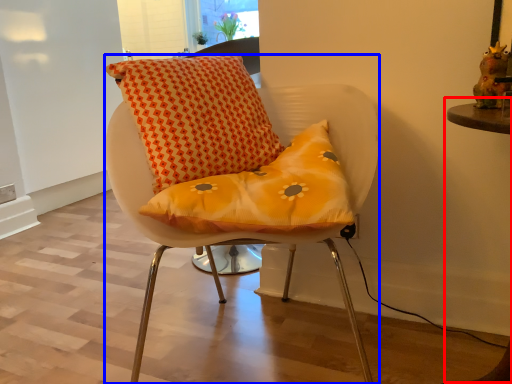
Question: Which point is further to the camera, table (highlighted by a red box) or chair (highlighted by a blue box)?

Choices:
 (A) table
 (B) chair

Answer: (B)